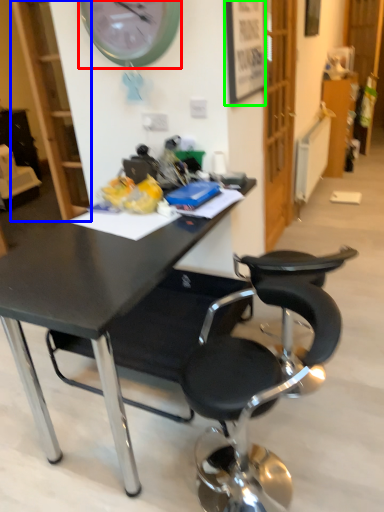
Question: Estimate the real-world distances between objects in this image. Which object is closer to wall clock (highlighted by a red box), bookshelf (highlighted by a blue box) or picture frame (highlighted by a green box)?

Choices:
 (A) bookshelf
 (B) picture frame

Answer: (B)